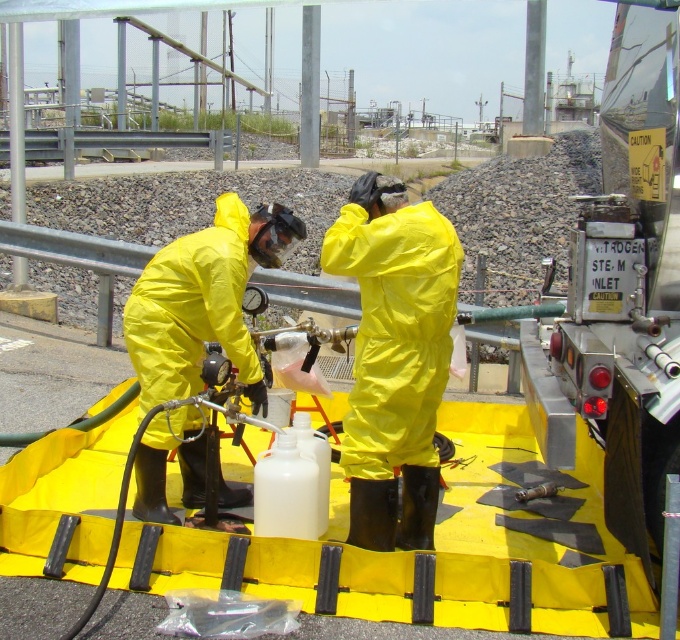
Looking at this image, which of these two, yellow matte suit at center or matte yellow hazmat suit at center, stands shorter?

With less height is matte yellow hazmat suit at center.

Is yellow matte suit at center smaller than matte yellow hazmat suit at center?

Correct, yellow matte suit at center occupies less space than matte yellow hazmat suit at center.

Locate an element on the screen. This screenshot has width=680, height=640. yellow matte suit at center is located at coordinates (394, 356).

Locate an element on the screen. Image resolution: width=680 pixels, height=640 pixels. yellow matte suit at center is located at coordinates (x=394, y=356).